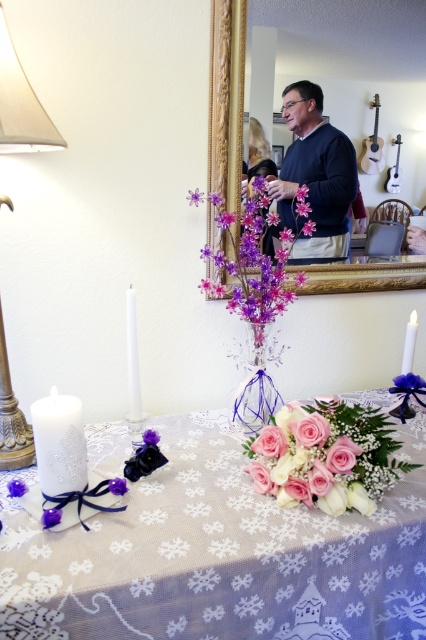
You are looking at the dining table scene and notice two points marked on the tablecloth. The first point is at coordinates point (405, 444) and the second is at point (406, 355). Which of these points is nearer to you?

Point (405, 444) is closer to the viewer than point (406, 355).

Based on the photo, you are planning to place a small vase between the white lace tablecloth at center and the white matte candle at right. Based on their sizes, which object should the vase be closer to?

The white lace tablecloth at center is much taller than the white matte candle at right, so the vase should be placed closer to the candle to maintain balance.